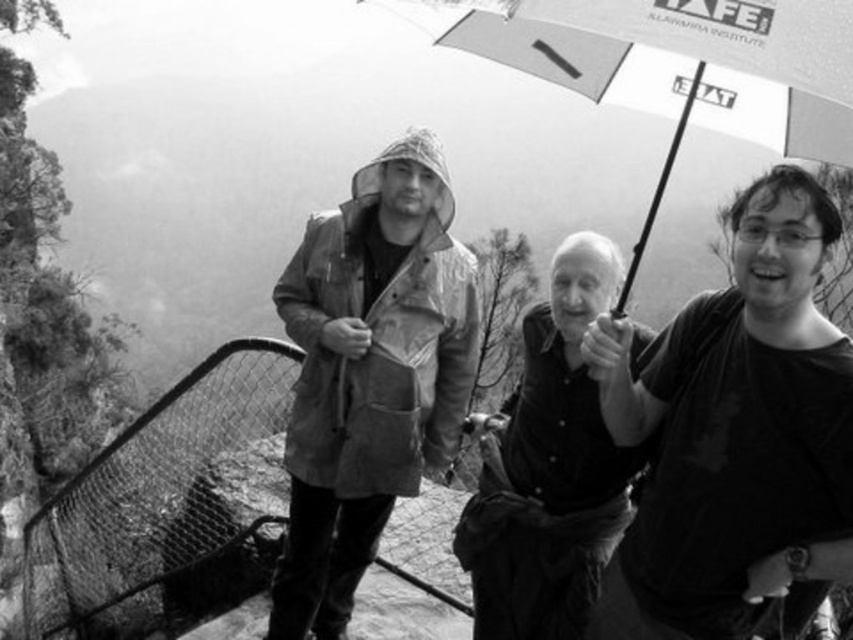
You are standing on the metal mesh rope bridge at center and want to reach the white fabric umbrella at center. Which direction should you move to get closer to the umbrella?

The metal mesh rope bridge at center is further to the viewer than the white fabric umbrella at center, so to reach the umbrella, you should move forward towards it.

From the picture: You are a hiker carrying a backpack weighing 15 kg. You need to cross the metal mesh rope bridge at center while wearing the smooth black shirt at center. Considering the bridge is wider than the shirt, will the shirt interfere with your ability to cross safely?

The metal mesh rope bridge at center is wider than the smooth black shirt at center, so the shirt will not interfere with crossing safely as the bridge provides sufficient width for movement.